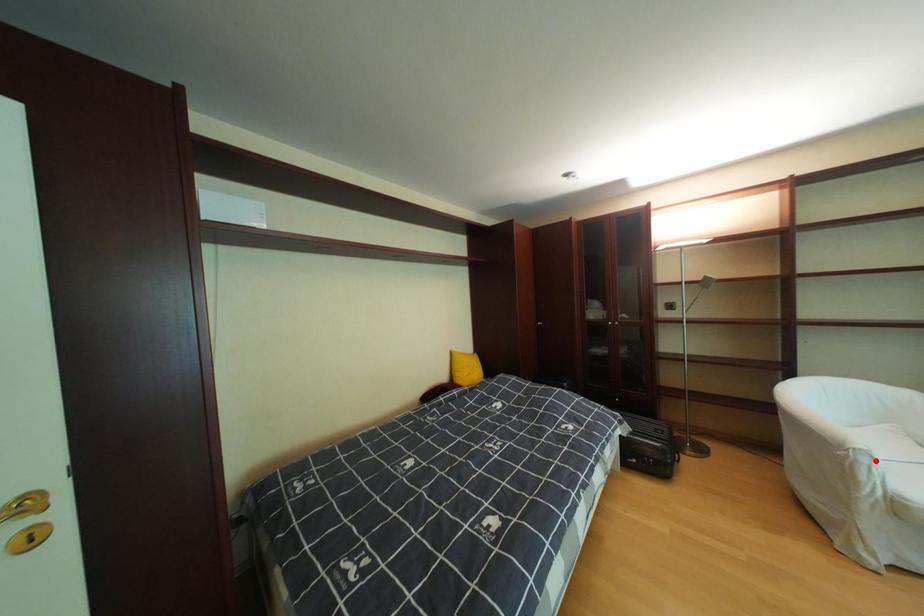
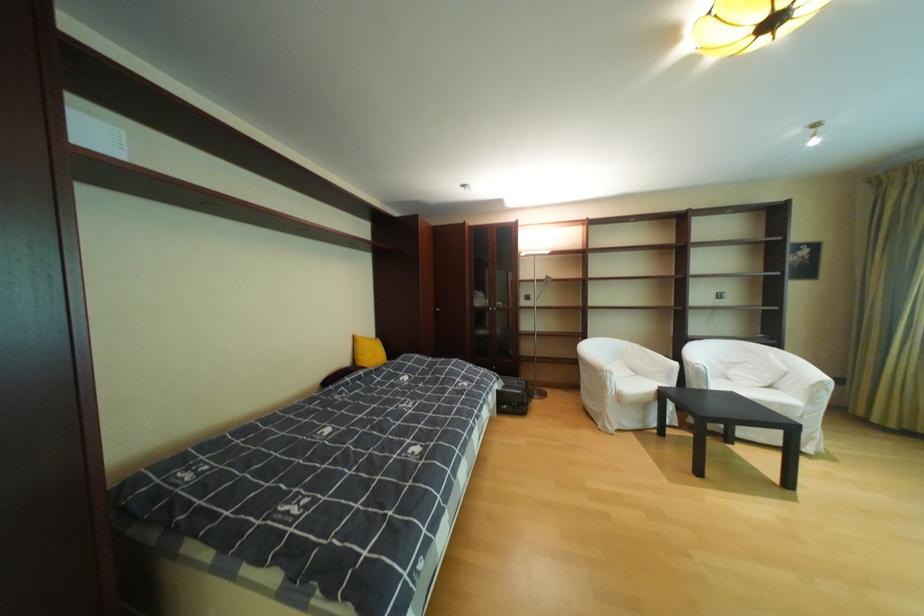
Question: I am providing you with two images of the same scene from different viewpoints. Given a red point in image1, look at the same physical point in image2. Is it:

Choices:
 (A) Closer to the viewpoint
 (B) Farther from the viewpoint

Answer: (B)